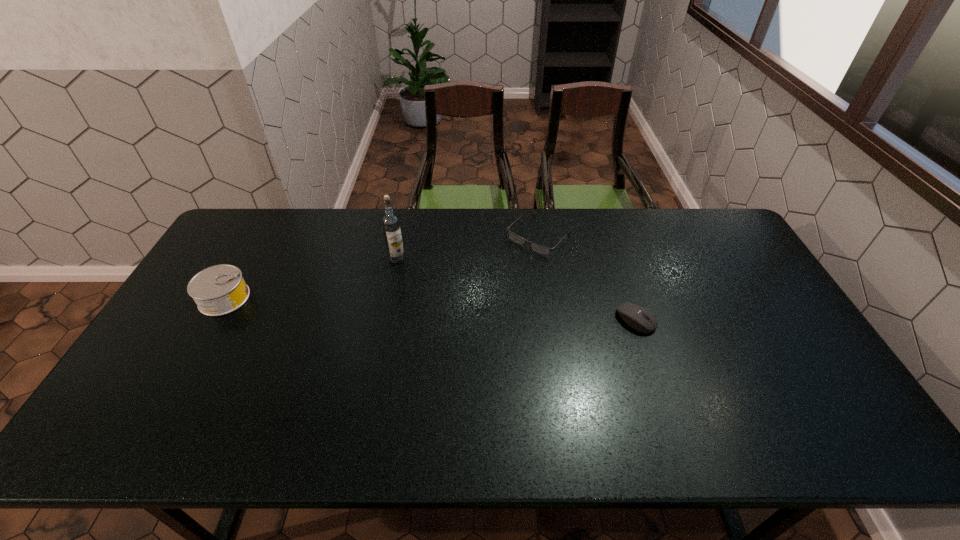
Where is `unoccupied area between the third object from right to left and the spectacles`? The width and height of the screenshot is (960, 540). unoccupied area between the third object from right to left and the spectacles is located at coordinates (468, 247).

The image size is (960, 540). Identify the location of object that is the second nearest to the computer equipment. (390, 222).

Point out which object is positioned as the third nearest to the computer equipment. Please provide its 2D coordinates. Your answer should be formatted as a tuple, i.e. [(x, y)], where the tuple contains the x and y coordinates of a point satisfying the conditions above.

[(218, 290)]

Where is `free space that satisfies the following two spatial constraints: 1. on the front side of the spectacles; 2. on the right side of the rightmost object`? The image size is (960, 540). free space that satisfies the following two spatial constraints: 1. on the front side of the spectacles; 2. on the right side of the rightmost object is located at coordinates (552, 319).

At what (x,y) coordinates should I click in order to perform the action: click on free spot that satisfies the following two spatial constraints: 1. on the back side of the third shortest object; 2. on the left side of the vodka. Please return your answer as a coordinate pair (x, y). Looking at the image, I should click on pyautogui.click(x=248, y=258).